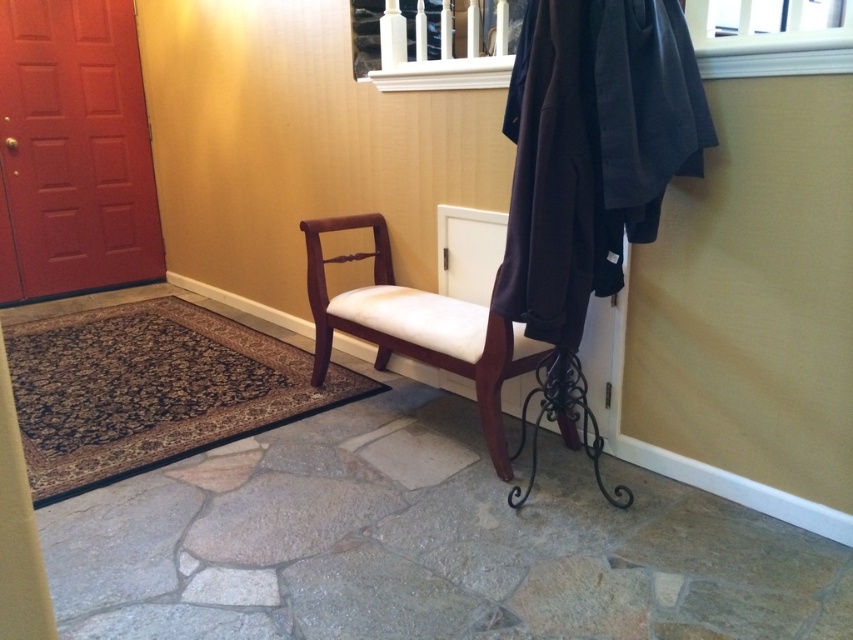
Looking at this image, is dark woolen robe at upper right positioned before matte red door at left?

Yes, dark woolen robe at upper right is in front of matte red door at left.

Locate an element on the screen. The image size is (853, 640). dark woolen robe at upper right is located at coordinates (592, 150).

Between point (589, 266) and point (117, 205), which one is positioned in front?

Positioned in front is point (589, 266).

This screenshot has height=640, width=853. What are the coordinates of `dark woolen robe at upper right` in the screenshot? It's located at (592, 150).

Is point (148, 125) closer to viewer compared to point (328, 228)?

That is False.

Can you confirm if matte red door at left is thinner than mahogany wood chair at center?

Yes.

Who is more forward, (111, 259) or (370, 224)?

Point (370, 224) is in front.

Locate an element on the screen. The height and width of the screenshot is (640, 853). matte red door at left is located at coordinates (76, 147).

Is point (581, 104) closer to camera compared to point (384, 294)?

Yes.

Locate an element on the screen. The height and width of the screenshot is (640, 853). dark woolen robe at upper right is located at coordinates [592, 150].

Who is more forward, (701, 120) or (389, 301)?

Point (701, 120) is in front.

Find the location of a particular element. This screenshot has height=640, width=853. dark woolen robe at upper right is located at coordinates (592, 150).